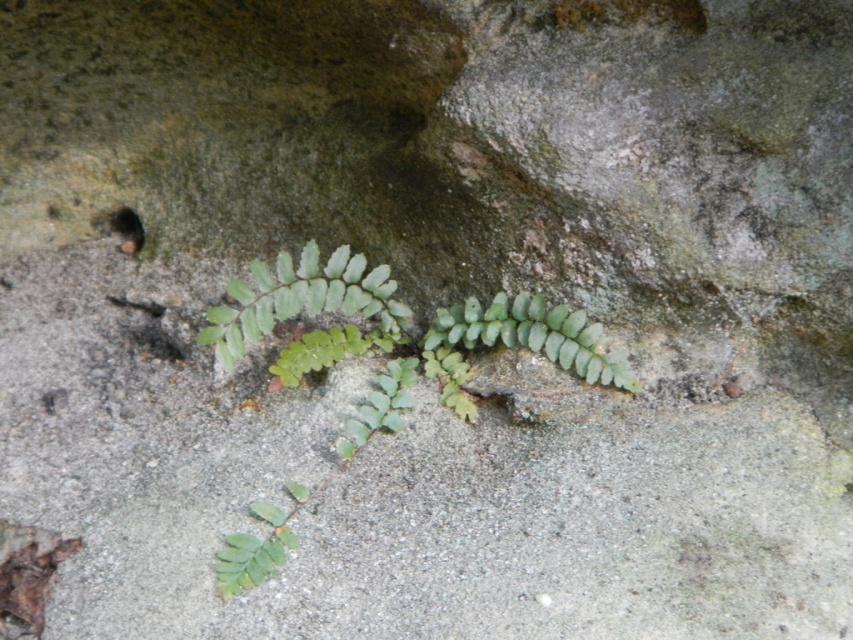
Question: Can you confirm if green leafy plant at center is positioned above green leafy fern at center?

Choices:
 (A) no
 (B) yes

Answer: (A)

Question: Is green leafy plant at center below green leafy fern at center?

Choices:
 (A) yes
 (B) no

Answer: (A)

Question: Is green leafy plant at center bigger than green leafy fern at center?

Choices:
 (A) yes
 (B) no

Answer: (A)

Question: Which point is closer to the camera?

Choices:
 (A) click(259, 552)
 (B) click(306, 262)

Answer: (A)